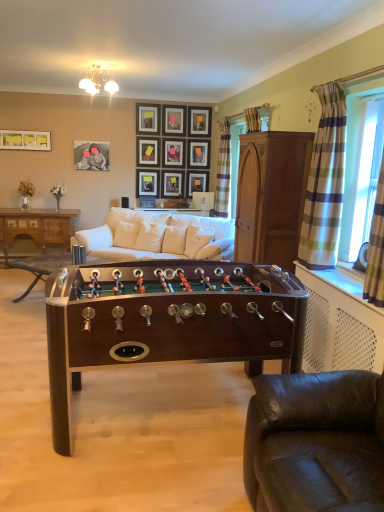
Question: Is the depth of matte black picture frame at upper center, the 3th picture frame in the left-to-right sequence, less than that of mahogany wood foosball table at center, arranged as the 2th table when viewed from the back?

Choices:
 (A) yes
 (B) no

Answer: (B)

Question: Is matte black picture frame at upper center, placed as the 8th picture frame when sorted from right to left, positioned with its back to mahogany wood foosball table at center, the 2th table from the right?

Choices:
 (A) no
 (B) yes

Answer: (A)

Question: Is matte black picture frame at upper center, placed as the 8th picture frame when sorted from right to left, positioned behind mahogany wood foosball table at center, placed as the 2th table when sorted from front to back?

Choices:
 (A) no
 (B) yes

Answer: (B)

Question: Can you confirm if matte black picture frame at upper center, the 3th picture frame in the left-to-right sequence, is positioned to the left of mahogany wood foosball table at center, placed as the 2th table when sorted from front to back?

Choices:
 (A) yes
 (B) no

Answer: (B)

Question: Is there a large distance between matte black picture frame at upper center, the 3th picture frame in the left-to-right sequence, and mahogany wood foosball table at center, placed as the 2th table when sorted from front to back?

Choices:
 (A) yes
 (B) no

Answer: (A)

Question: Visually, is matte black picture frame at upper left, which appears as the 1th picture frame when viewed from the left, positioned to the left or to the right of plaid fabric curtain at right, placed as the second curtain when sorted from left to right?

Choices:
 (A) right
 (B) left

Answer: (B)

Question: Considering the positions of matte black picture frame at upper left, placed as the tenth picture frame when sorted from right to left, and plaid fabric curtain at right, placed as the second curtain when sorted from left to right, in the image, is matte black picture frame at upper left, placed as the tenth picture frame when sorted from right to left, taller or shorter than plaid fabric curtain at right, placed as the second curtain when sorted from left to right,?

Choices:
 (A) tall
 (B) short

Answer: (B)

Question: Is matte black picture frame at upper left, placed as the tenth picture frame when sorted from right to left, inside or outside of plaid fabric curtain at right, placed as the second curtain when sorted from left to right?

Choices:
 (A) inside
 (B) outside

Answer: (B)

Question: Looking at their shapes, would you say matte black picture frame at upper left, placed as the tenth picture frame when sorted from right to left, is wider or thinner than plaid fabric curtain at right, which appears as the 1th curtain when viewed from the right?

Choices:
 (A) wide
 (B) thin

Answer: (B)

Question: Considering the positions of matte black picture frame at upper center, placed as the 2th picture frame when sorted from left to right, and white fabric pillow at center, which is the third pillow in left-to-right order, in the image, is matte black picture frame at upper center, placed as the 2th picture frame when sorted from left to right, taller or shorter than white fabric pillow at center, which is the third pillow in left-to-right order,?

Choices:
 (A) short
 (B) tall

Answer: (B)

Question: Is point (152, 184) positioned closer to the camera than point (201, 227)?

Choices:
 (A) farther
 (B) closer

Answer: (A)

Question: From a real-world perspective, is matte black picture frame at upper center, which is the ninth picture frame in right-to-left order, above or below white fabric pillow at center, which is the third pillow in left-to-right order?

Choices:
 (A) below
 (B) above

Answer: (B)

Question: Considering the positions of matte black picture frame at upper center, which is the ninth picture frame in right-to-left order, and white fabric pillow at center, which is the third pillow in left-to-right order, in the image, is matte black picture frame at upper center, which is the ninth picture frame in right-to-left order, bigger or smaller than white fabric pillow at center, which is the third pillow in left-to-right order,?

Choices:
 (A) small
 (B) big

Answer: (A)

Question: Is matte black picture frame at upper center, arranged as the 5th picture frame when viewed from the right, inside or outside of mahogany wood cabinet at right?

Choices:
 (A) outside
 (B) inside

Answer: (A)

Question: From the image's perspective, is matte black picture frame at upper center, positioned as the sixth picture frame in left-to-right order, located above or below mahogany wood cabinet at right?

Choices:
 (A) above
 (B) below

Answer: (A)